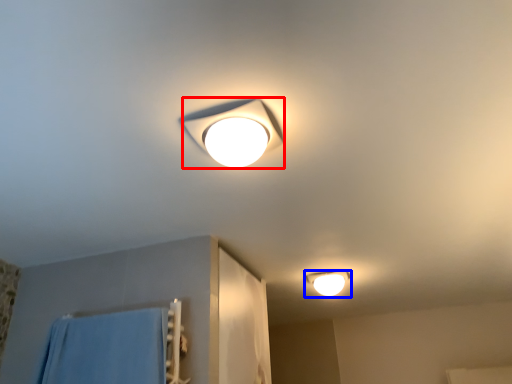
Question: Among these objects, which one is farthest to the camera, lamp (highlighted by a red box) or lamp (highlighted by a blue box)?

Choices:
 (A) lamp
 (B) lamp

Answer: (B)